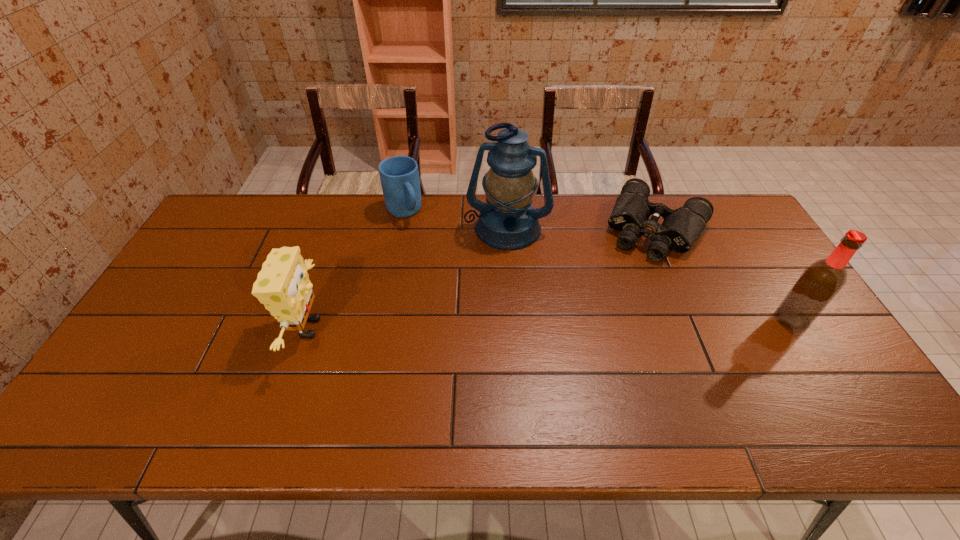
The width and height of the screenshot is (960, 540). Find the location of `free spot on the desktop that is between the third tallest object and the fourth shortest object and is positioned on the face of the third object from left to right`. free spot on the desktop that is between the third tallest object and the fourth shortest object and is positioned on the face of the third object from left to right is located at coordinates click(483, 325).

Identify the location of free space on the desktop that is between the third tallest object and the fourth shortest object and is positioned on the side of the fourth tallest object with the handle. (482, 325).

The image size is (960, 540). Find the location of `free space on the desktop that is between the sponge and the fourth shortest object and is positioned through the eyepieces of the binoculars`. free space on the desktop that is between the sponge and the fourth shortest object and is positioned through the eyepieces of the binoculars is located at coordinates (610, 322).